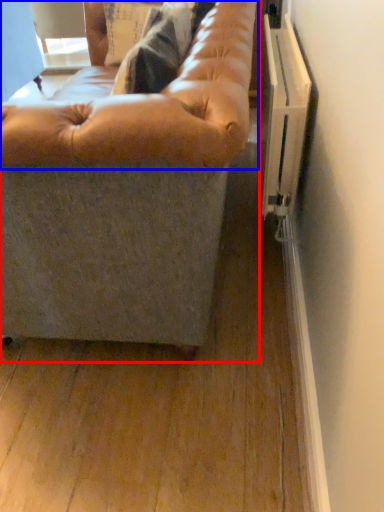
Question: Which point is further to the camera, studio couch (highlighted by a red box) or bean bag chair (highlighted by a blue box)?

Choices:
 (A) studio couch
 (B) bean bag chair

Answer: (B)